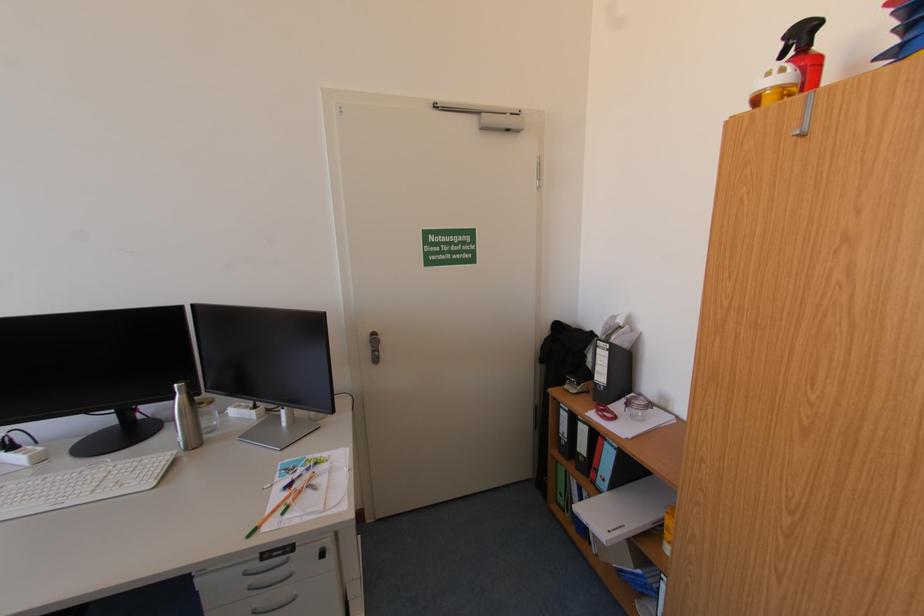
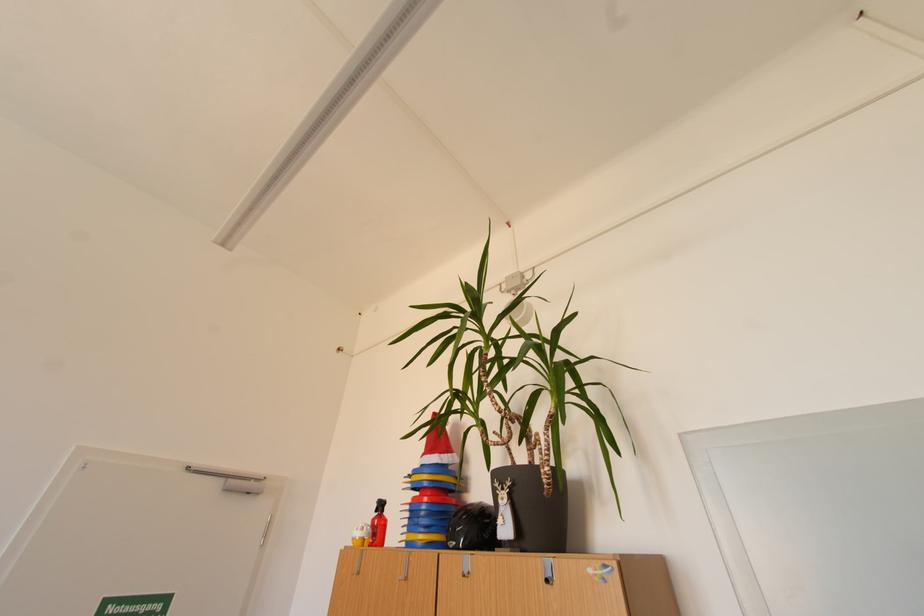
Where in the second image is the point corresponding to pixel 784 71 from the first image?

(368, 530)